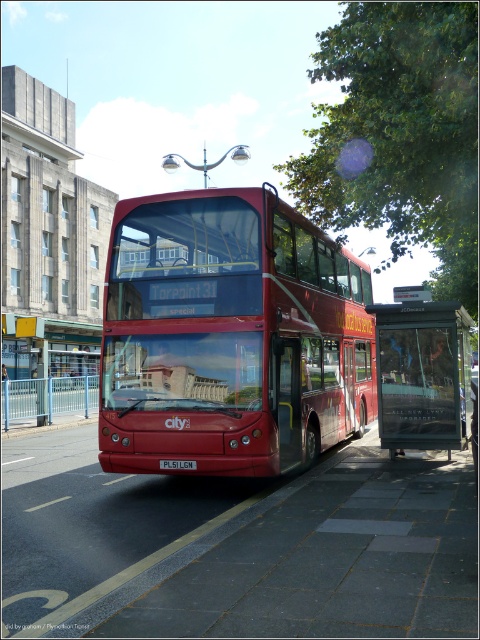
You are a photographer planning to take a picture of the shiny red bus at center and the red plastic license plate at center. Which object should you focus on first if you want to ensure both are in sharp focus, considering their sizes?

A: The shiny red bus at center is larger than the red plastic license plate at center, so focusing on the shiny red bus at center first would help ensure both are in sharp focus.

Based on the photo, you are standing at the bus stop and want to know which of the two points, point (420, 356) or point (168, 465), is closer to you. Which one is closer?

Point (420, 356) is further to the viewer than point (168, 465), so point (168, 465) is closer to you.

From the picture: You are a delivery person trying to place a new license plate on the bus. The current license plate is covered by the bus stop. Can you access the red plastic license plate at center without moving the metallic bus stop at center?

The metallic bus stop at center is positioned over the red plastic license plate at center, so you cannot access the red plastic license plate at center without moving the metallic bus stop at center.